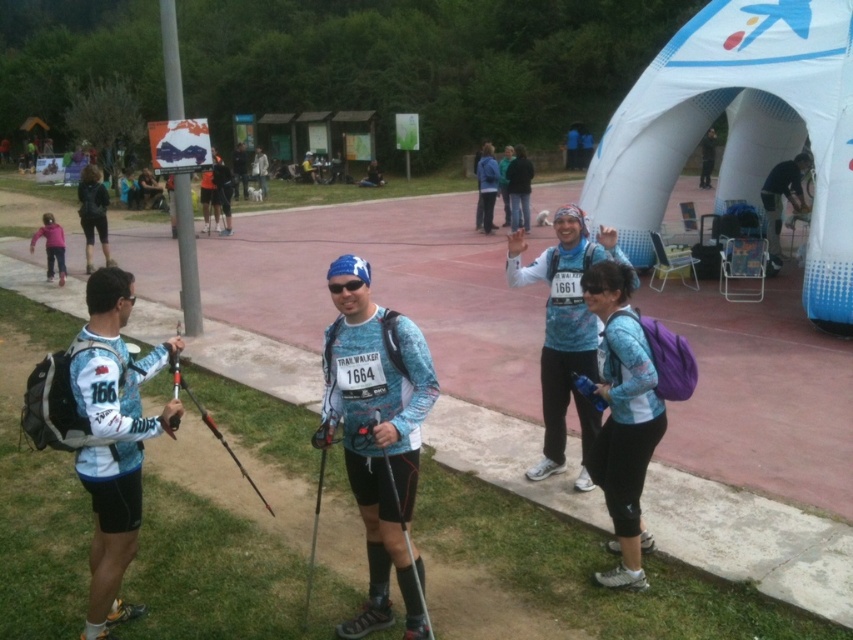
Does blue textured shirt at center have a lesser height compared to matte black ski pole at center?

In fact, blue textured shirt at center may be taller than matte black ski pole at center.

Between point (601, 369) and point (178, 390), which one is positioned in front?

Point (601, 369)

Is point (653, 406) in front of point (247, 477)?

No, it is not.

Find the location of a particular element. This screenshot has height=640, width=853. blue textured shirt at center is located at coordinates (624, 419).

From the picture: Does matte blue jersey at left have a lesser width compared to matte black ski pole at center?

Indeed, matte blue jersey at left has a lesser width compared to matte black ski pole at center.

Who is more distant from viewer, (96, 520) or (178, 364)?

Point (178, 364)

Measure the distance between point (90, 614) and camera.

3.69 meters

The height and width of the screenshot is (640, 853). I want to click on matte blue jersey at left, so click(114, 442).

Is matte blue ski pole at center behind blue fabric skier at center?

That is False.

Can you confirm if matte blue ski pole at center is taller than blue fabric skier at center?

In fact, matte blue ski pole at center may be shorter than blue fabric skier at center.

What do you see at coordinates (376, 435) in the screenshot? I see `matte blue ski pole at center` at bounding box center [376, 435].

The height and width of the screenshot is (640, 853). Find the location of `matte blue ski pole at center`. matte blue ski pole at center is located at coordinates (376, 435).